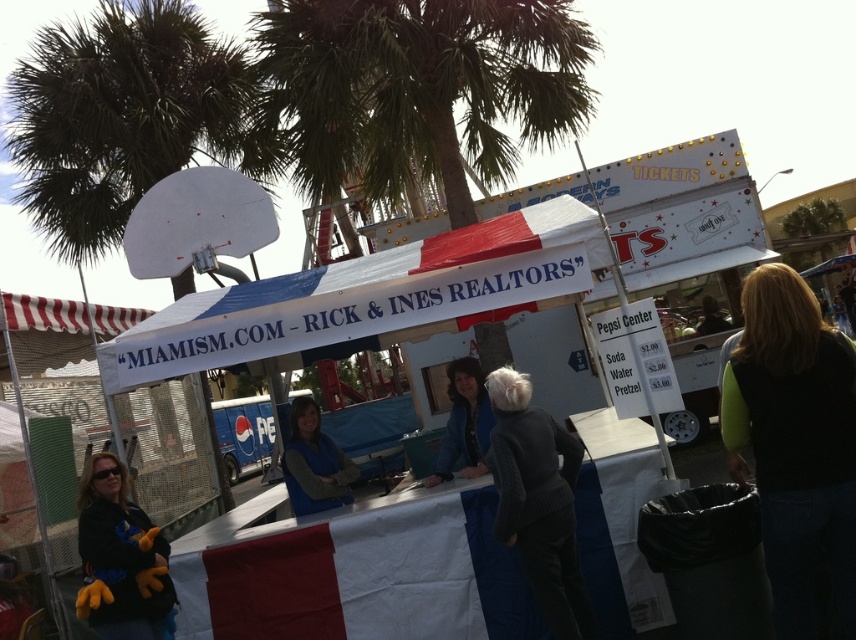
In the scene shown: Does green leafy palm tree at upper left appear over green fleece vest at lower right?

Indeed, green leafy palm tree at upper left is positioned over green fleece vest at lower right.

Is point (54, 131) in front of point (836, 444)?

No, it is behind (836, 444).

Locate an element on the screen. This screenshot has height=640, width=856. green leafy palm tree at upper left is located at coordinates (119, 115).

Which is behind, point (828, 525) or point (153, 621)?

The point (153, 621) is more distant.

Between point (789, 436) and point (99, 497), which one is positioned in front?

Positioned in front is point (789, 436).

Where is `green fleece vest at lower right`? The height and width of the screenshot is (640, 856). green fleece vest at lower right is located at coordinates (795, 448).

Is green leafy palm tree at upper center positioned in front of green leafy palm tree at upper left?

Yes, green leafy palm tree at upper center is closer to the viewer.

Is green leafy palm tree at upper center to the right of green leafy palm tree at upper left from the viewer's perspective?

Yes, green leafy palm tree at upper center is to the right of green leafy palm tree at upper left.

Who is more distant from viewer, (360, 29) or (238, 156)?

Positioned behind is point (238, 156).

At what (x,y) coordinates should I click in order to perform the action: click on green leafy palm tree at upper center. Please return your answer as a coordinate pair (x, y). Looking at the image, I should click on (420, 88).